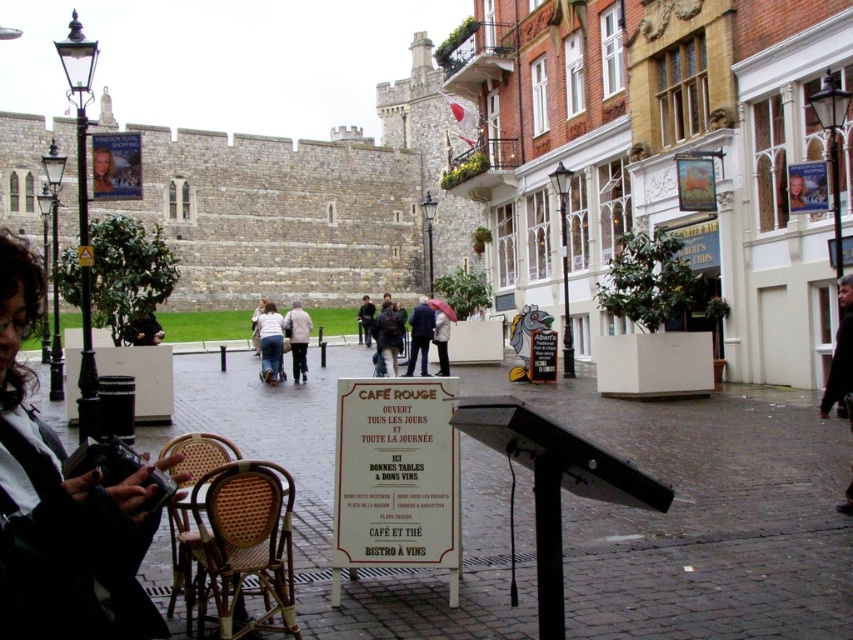
You are standing in the town square and want to take a photo of the point at coordinates (106, 632). The camera you have can focus on objects up to 20 meters away. Will the point be in focus?

The point at coordinates (106, 632) is 19.13 meters from the camera, which is within the camera focus range of up to 20 meters. Therefore, the point will be in focus.

You are standing in the town square and want to take a photo of both the point at coordinates (106,582) and the point at coordinates (138,337). Which point should you focus on first to ensure both are in clear view?

You should focus on point (106,582) first because it is closer to the camera than point (138,337), ensuring both points are in focus when using depth of field.

Consider the image. You are a tourist in the town square and you want to find the person wearing both the denim pants at center and the light beige jacket at center. Which clothing item would you look for first if you want to spot them from a distance?

The light beige jacket at center is larger than the denim pants at center, so you should look for the light beige jacket at center first as it is more visible from a distance.